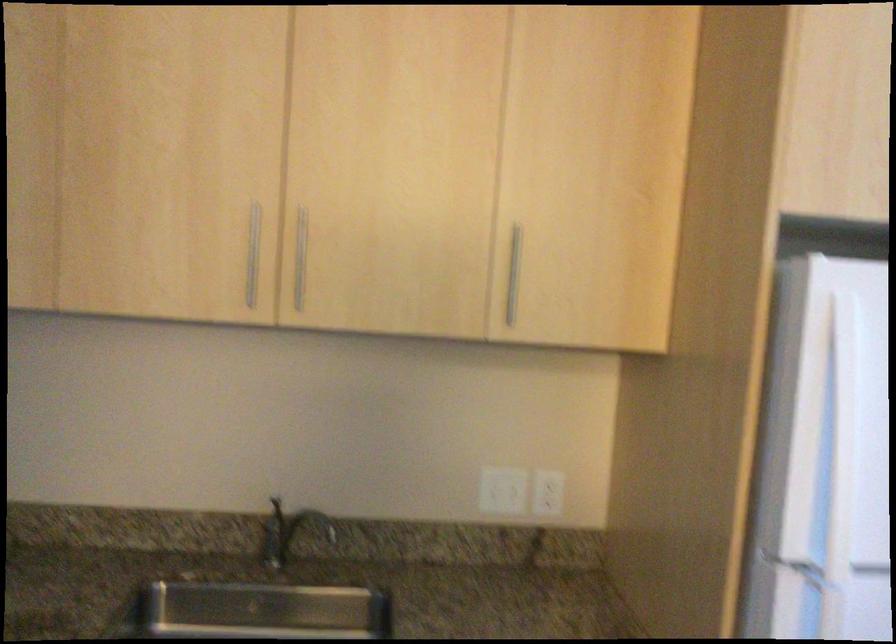
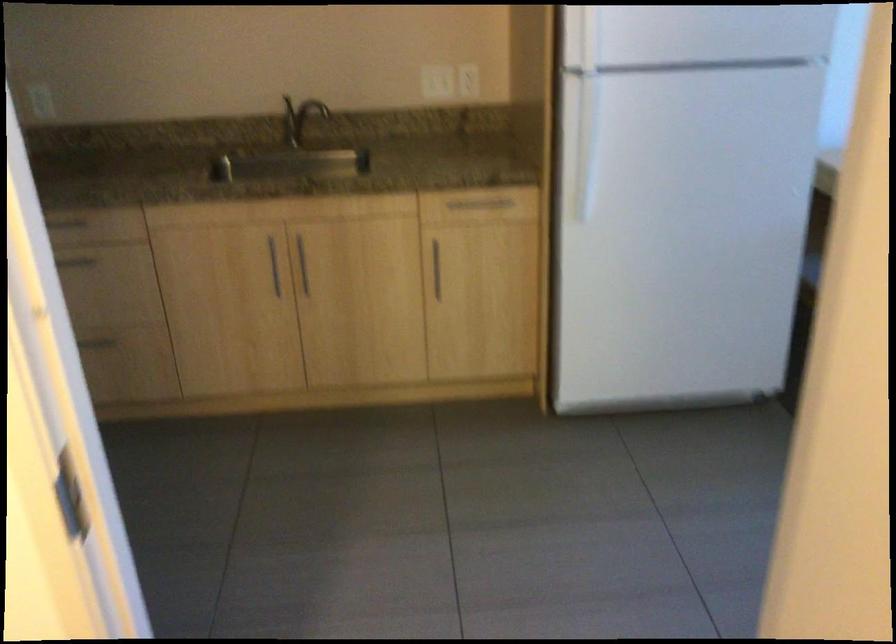
Where in the second image is the point corresponding to pixel 498 484 from the first image?

(433, 80)